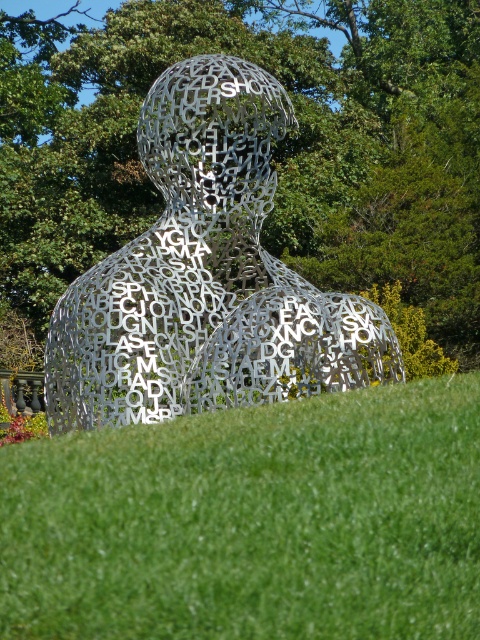
Question: Which object is farther from the camera taking this photo?

Choices:
 (A) metallic silver sculpture at center
 (B) green grass at center

Answer: (A)

Question: Does green grass at center lie in front of metallic silver sculpture at center?

Choices:
 (A) no
 (B) yes

Answer: (B)

Question: Does green grass at center have a greater width compared to metallic silver sculpture at center?

Choices:
 (A) no
 (B) yes

Answer: (B)

Question: Which point is closer to the camera taking this photo?

Choices:
 (A) (361, 419)
 (B) (235, 260)

Answer: (A)

Question: Is green grass at center above metallic silver sculpture at center?

Choices:
 (A) yes
 (B) no

Answer: (B)